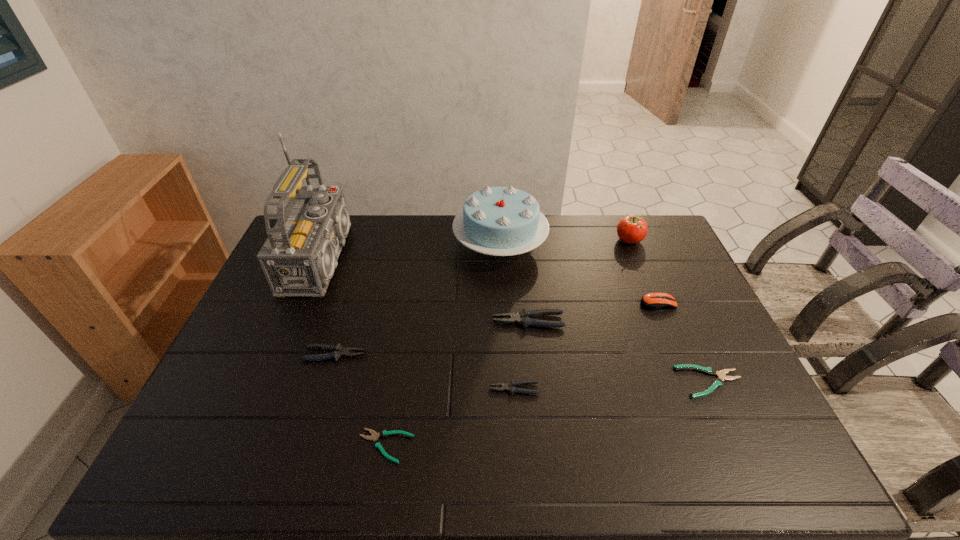
The height and width of the screenshot is (540, 960). Identify the location of vacant space situated on the left of the red tomato. (522, 240).

At what (x,y) coordinates should I click in order to perform the action: click on vacant area situated 0.350m on the left of the orange computer mouse. Please return your answer as a coordinate pair (x, y). Image resolution: width=960 pixels, height=540 pixels. Looking at the image, I should click on (527, 303).

Identify the location of free space located 0.050m at the gripping part of the fifth tallest object. The height and width of the screenshot is (540, 960). (476, 321).

Locate an element on the screen. The height and width of the screenshot is (540, 960). vacant space situated at the gripping part of the fifth tallest object is located at coordinates (372, 321).

Identify the location of free space located 0.100m at the gripping part of the fifth tallest object. The width and height of the screenshot is (960, 540). (460, 321).

You are a GUI agent. You are given a task and a screenshot of the screen. Output one action in this format:
    pyautogui.click(x=<x>, y=<y>)
    Task: Click on the vacant space located at the gripping part of the fourth shortest object
    
    Given the screenshot: What is the action you would take?
    pyautogui.click(x=495, y=354)

Image resolution: width=960 pixels, height=540 pixels. Identify the location of free space located at the gripping part of the third shortest pliers. (354, 389).

You are a GUI agent. You are given a task and a screenshot of the screen. Output one action in this format:
    pyautogui.click(x=<x>, y=<y>)
    Task: Click on the vacant space located at the gripping part of the third shortest pliers
    
    Given the screenshot: What is the action you would take?
    pyautogui.click(x=463, y=389)

Find the location of a particular element. This screenshot has height=540, width=960. free space located at the gripping part of the third shortest pliers is located at coordinates (358, 389).

Identify the location of vacant space located 0.150m on the back of the fourth tallest pliers. (684, 325).